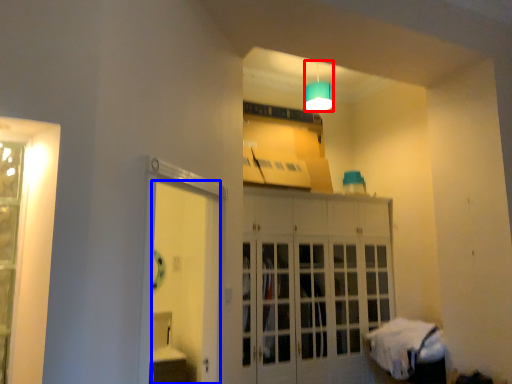
Question: Which object is further to the camera taking this photo, lamp (highlighted by a red box) or door (highlighted by a blue box)?

Choices:
 (A) lamp
 (B) door

Answer: (A)